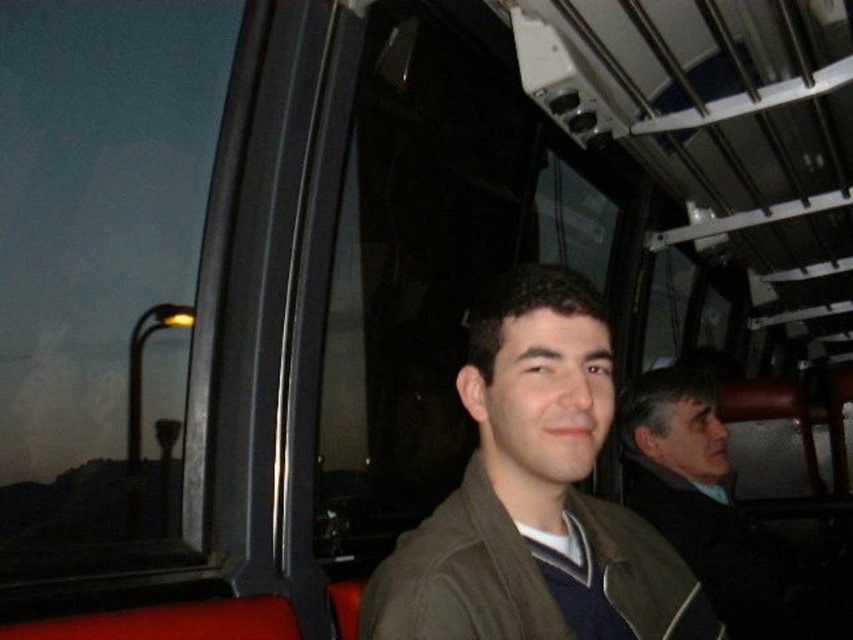
Which is more to the right, matte brown jacket at center or dark brown leather jacket at right?

Positioned to the right is dark brown leather jacket at right.

Who is positioned more to the left, matte brown jacket at center or dark brown leather jacket at right?

matte brown jacket at center

You are a GUI agent. You are given a task and a screenshot of the screen. Output one action in this format:
    pyautogui.click(x=<x>, y=<y>)
    Task: Click on the matte brown jacket at center
    
    Given the screenshot: What is the action you would take?
    pyautogui.click(x=535, y=496)